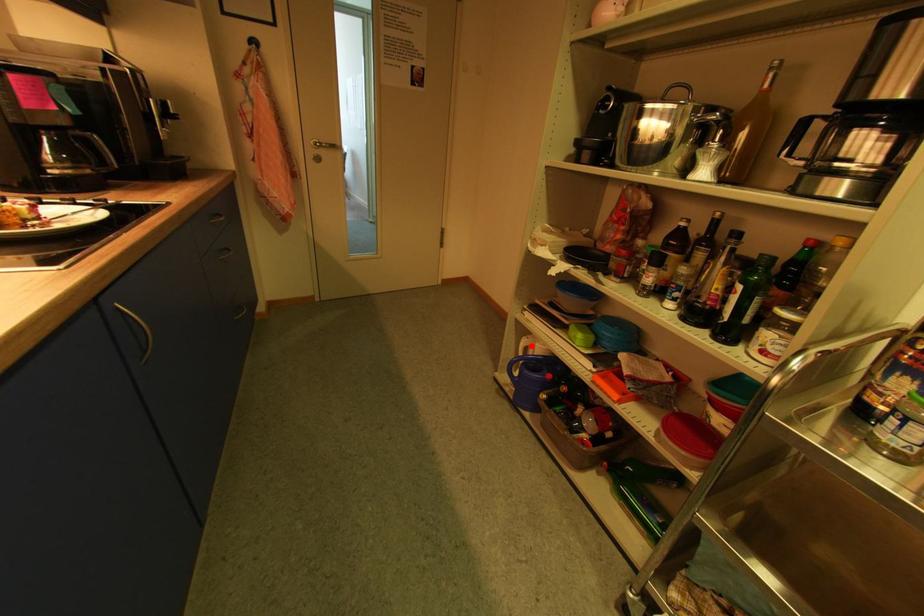
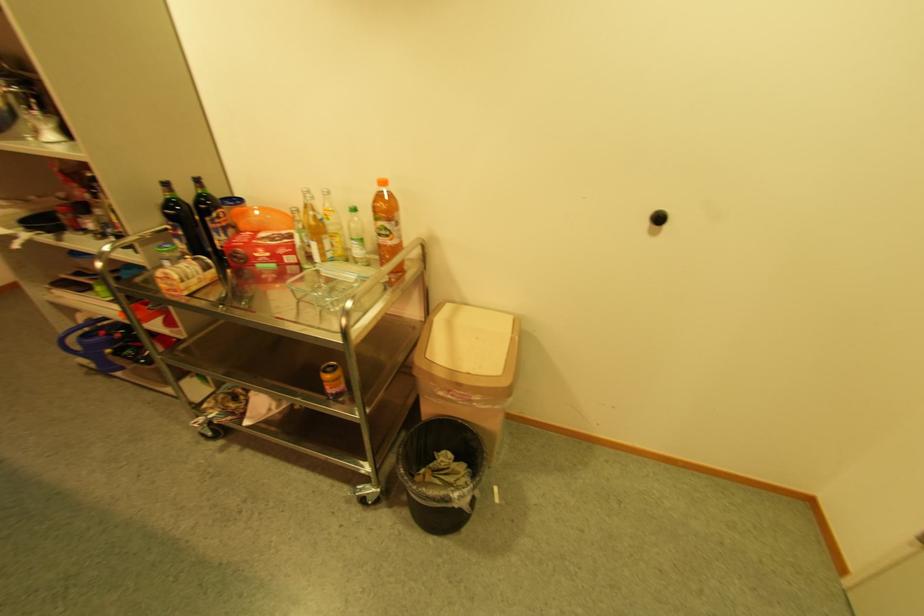
In the second image, find the point that corresponds to the highlighted location in the first image.

(91, 320)